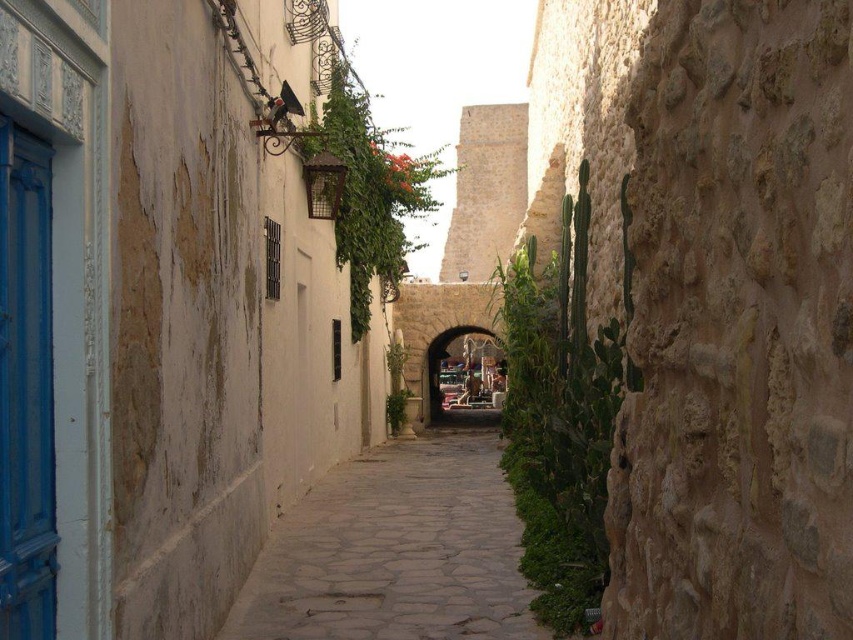
Question: Can you confirm if pebble stone path at center is wider than stone archway at center?

Choices:
 (A) no
 (B) yes

Answer: (A)

Question: Is pebble stone path at center smaller than stone archway at center?

Choices:
 (A) yes
 (B) no

Answer: (A)

Question: Among these points, which one is farthest from the camera?

Choices:
 (A) (437, 394)
 (B) (523, 586)

Answer: (A)

Question: Does pebble stone path at center come in front of stone archway at center?

Choices:
 (A) no
 (B) yes

Answer: (B)